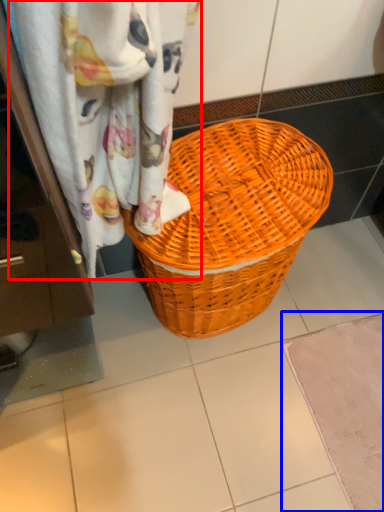
Question: Which of the following is the farthest to the observer, curtain (highlighted by a red box) or bath mat (highlighted by a blue box)?

Choices:
 (A) curtain
 (B) bath mat

Answer: (B)